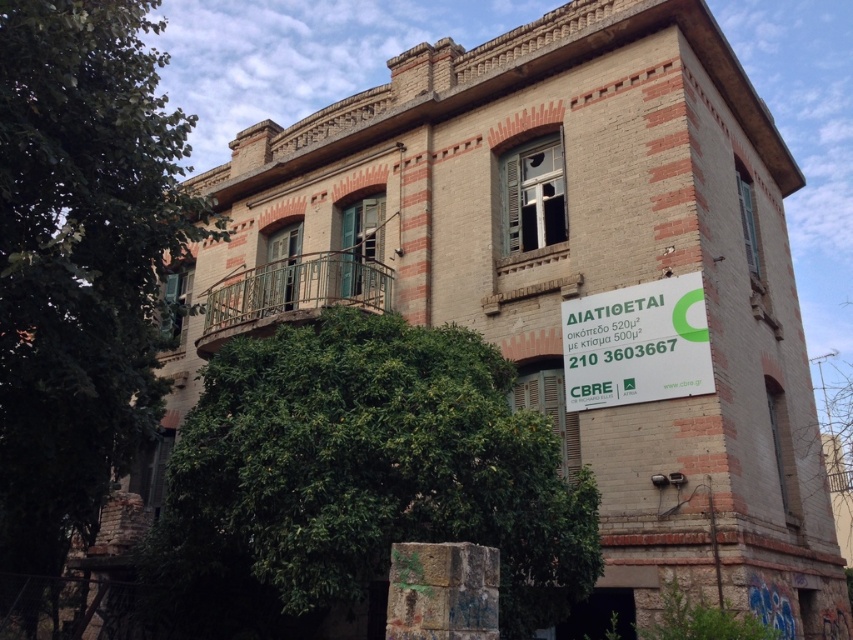
Is green leafy tree at center bigger than green paper sign at center?

Correct, green leafy tree at center is larger in size than green paper sign at center.

Is green leafy tree at center in front of green paper sign at center?

Yes, it is in front of green paper sign at center.

Where is `green leafy tree at center`? The image size is (853, 640). green leafy tree at center is located at coordinates (360, 477).

You are a GUI agent. You are given a task and a screenshot of the screen. Output one action in this format:
    pyautogui.click(x=<x>, y=<y>)
    Task: Click on the green leafy tree at center
    The height and width of the screenshot is (640, 853).
    Given the screenshot: What is the action you would take?
    pyautogui.click(x=360, y=477)

Looking at this image, between green leafy tree at center and green leafy tree at left, which one has more height?

green leafy tree at left

Who is more distant from viewer, [364,481] or [135,180]?

Point [135,180]

Locate an element on the screen. The width and height of the screenshot is (853, 640). green leafy tree at center is located at coordinates (360, 477).

From the picture: Can you confirm if green leafy tree at left is bigger than green paper sign at center?

Correct, green leafy tree at left is larger in size than green paper sign at center.

Who is shorter, green leafy tree at left or green paper sign at center?

green paper sign at center is shorter.

The height and width of the screenshot is (640, 853). Describe the element at coordinates (80, 275) in the screenshot. I see `green leafy tree at left` at that location.

Where is `green leafy tree at left`? green leafy tree at left is located at coordinates (80, 275).